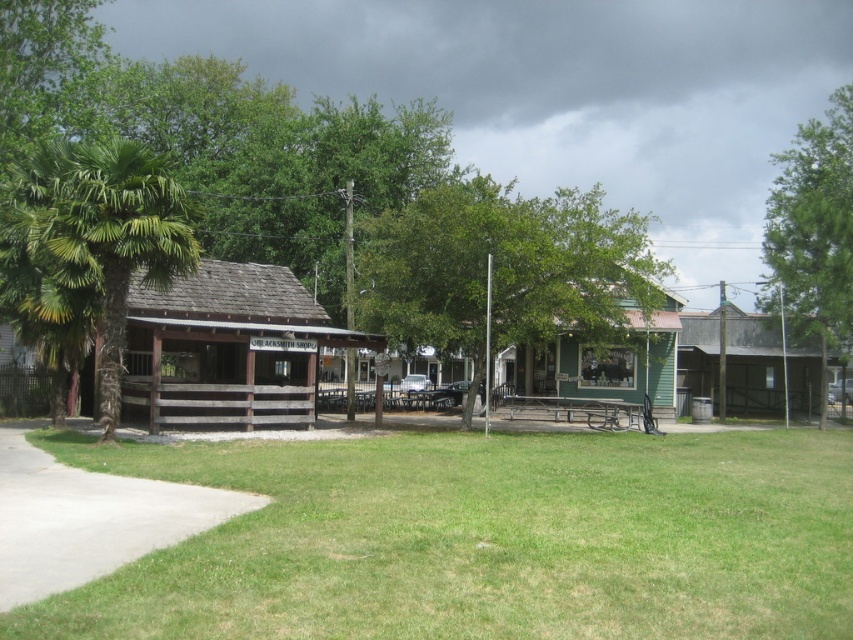
You are standing at the edge of the green grass at center and want to sit down. Is the green wood picnic table at center above or below you?

The green grass at center is below the green wood picnic table at center, so the picnic table is above you.

You are standing at the edge of the grassy area and want to reach the picnic table. Based on the scene, which direction should you move to get to the green wood picnic table at center from the green grass at center?

The green grass at center is in front of the green wood picnic table at center, so you should move backward to reach the picnic table.

You are a visitor in this small town and want to sit at the green wood picnic table at center. From your current position, which direction should you look to see the green leafy tree at upper right?

The green leafy tree at upper right is above the green wood picnic table at center, so you should look upwards to see the green leafy tree at upper right.